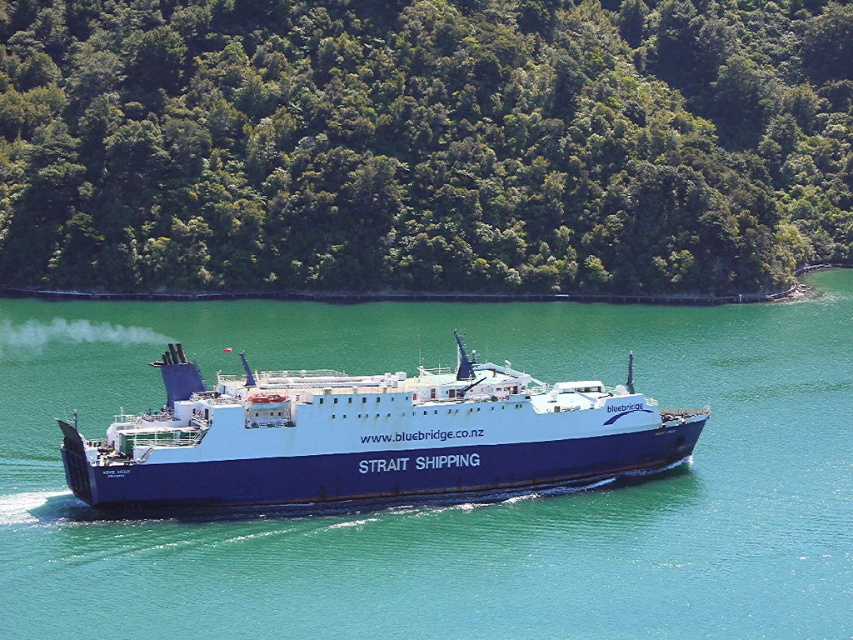
Question: Observing the image, what is the correct spatial positioning of blue-green water at center in reference to blue matte ship at center?

Choices:
 (A) right
 (B) left

Answer: (B)

Question: Is blue-green water at center to the left of blue matte ship at center from the viewer's perspective?

Choices:
 (A) yes
 (B) no

Answer: (A)

Question: Is blue-green water at center thinner than blue matte ship at center?

Choices:
 (A) no
 (B) yes

Answer: (A)

Question: Estimate the real-world distances between objects in this image. Which object is closer to the blue-green water at center?

Choices:
 (A) green leafy trees at center
 (B) blue matte ship at center

Answer: (B)

Question: Which of these objects is positioned farthest from the blue-green water at center?

Choices:
 (A) blue matte ship at center
 (B) green leafy trees at center

Answer: (B)

Question: Among these points, which one is nearest to the camera?

Choices:
 (A) (482, 460)
 (B) (497, 29)
 (C) (51, 497)

Answer: (C)